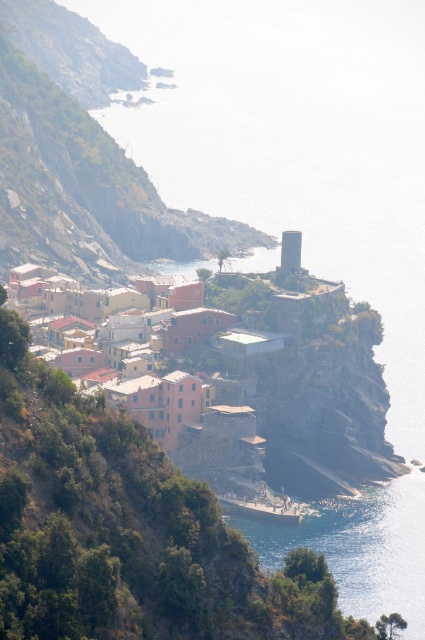
Which is in front, point (13, 88) or point (11, 284)?

Point (11, 284) is in front.

Consider the image. Does rustic stone buildings at center have a greater width compared to matte pink buildings at center?

Yes, rustic stone buildings at center is wider than matte pink buildings at center.

Which is behind, point (122, 68) or point (238, 442)?

Point (122, 68)

At what (x,y) coordinates should I click in order to perform the action: click on rustic stone buildings at center. Please return your answer as a coordinate pair (x, y). This screenshot has width=425, height=640. Looking at the image, I should click on (82, 156).